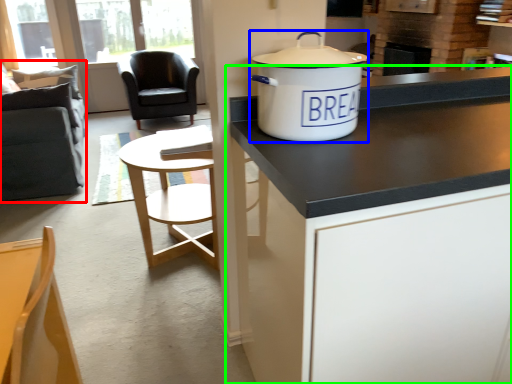
Question: Considering the real-world distances, which object is farthest from swivel chair (highlighted by a red box)? cooker (highlighted by a blue box) or cabinetry (highlighted by a green box)?

Choices:
 (A) cooker
 (B) cabinetry

Answer: (B)